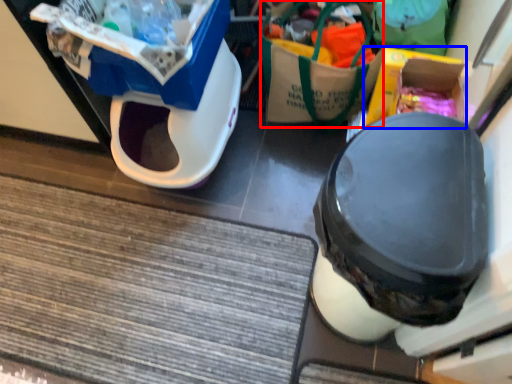
Question: Which of the following is the closest to the observer, garbage (highlighted by a red box) or storage box (highlighted by a blue box)?

Choices:
 (A) garbage
 (B) storage box

Answer: (B)